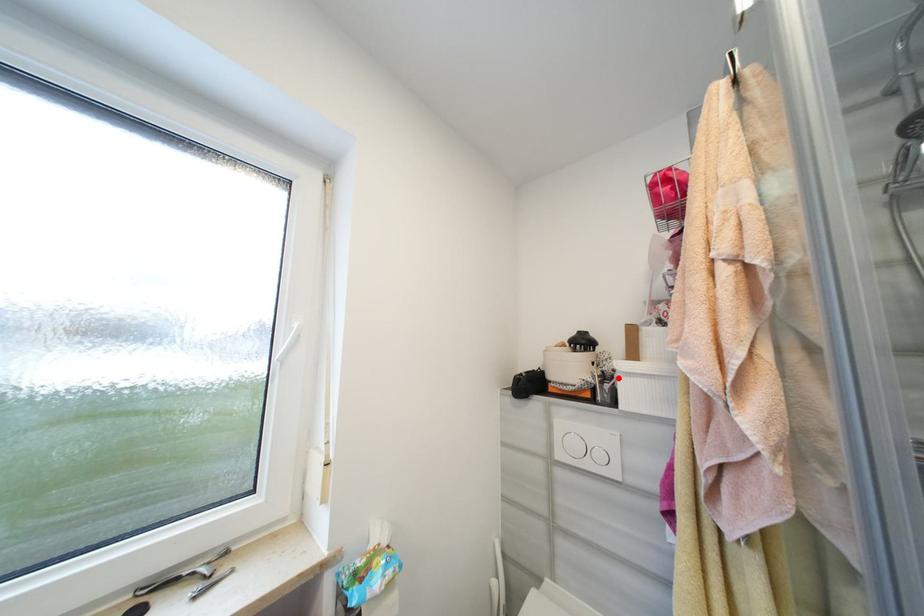
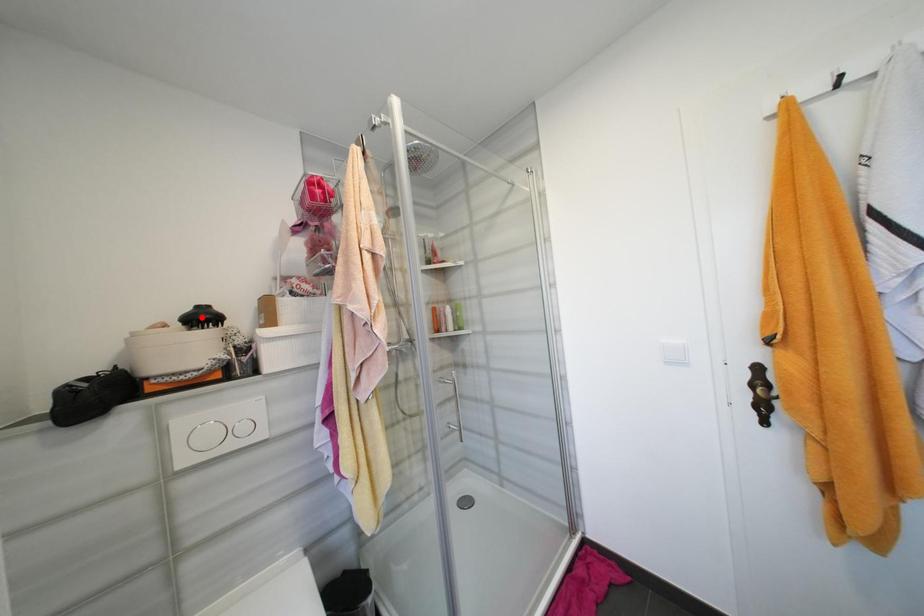
I am providing you with two images of the same scene from different viewpoints. A red point is marked on the first image and another point is marked on the second image. Does the point marked in image1 correspond to the same location as the one in image2?

No